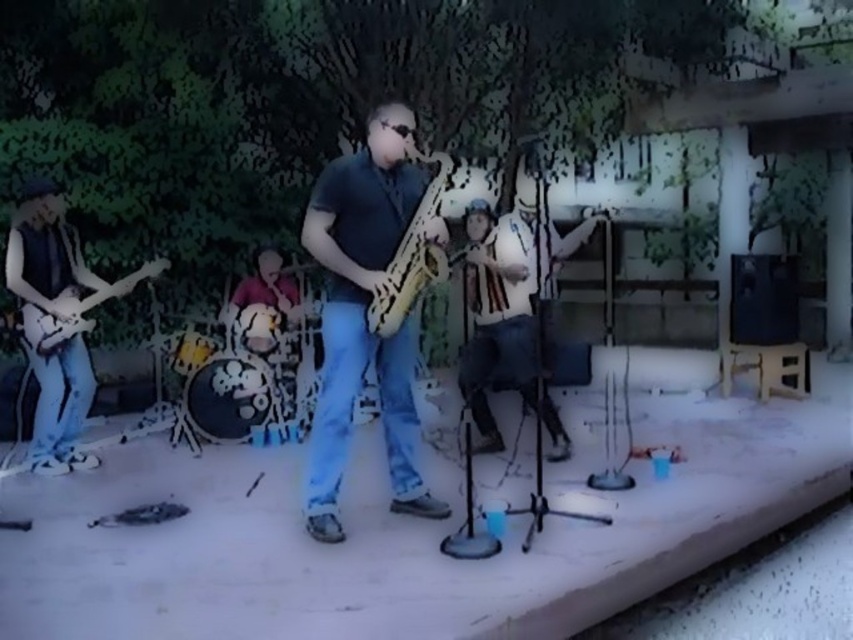
Based on the scene description provided, where exactly is the wooden saxophone at center located in terms of coordinates?

The wooden saxophone at center is located at point coordinates of (415, 257).

You are a photographer trying to capture a clear shot of both the matte yellow saxophone at center and the wooden saxophone at center. Which saxophone will appear larger in your photo?

The matte yellow saxophone at center will appear larger in the photo because it is closer to the viewer than the wooden saxophone at center.

You are standing at the point labeled point [48,305] and want to move to the point labeled point [431,220]. Can you walk directly towards it without any obstacles in your path?

Yes, you can walk directly towards the point labeled point [431,220] from your current position at point [48,305] because the first point is in front of the second one, indicating a clear path.